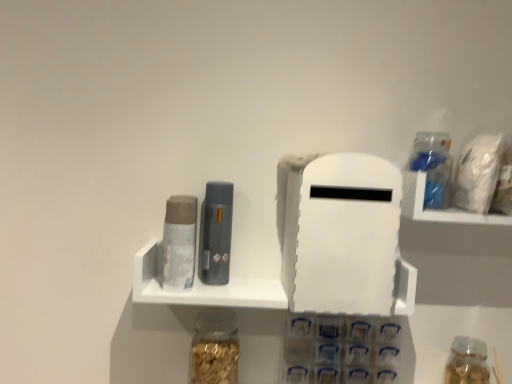
Question: In the image, is white matte plastic shelf at center on the left side or the right side of translucent plastic container at upper right?

Choices:
 (A) right
 (B) left

Answer: (B)

Question: Is white matte plastic shelf at center bigger or smaller than translucent plastic container at upper right?

Choices:
 (A) big
 (B) small

Answer: (A)

Question: Which object is the farthest from the matte gray toiletry at center, which ranks as the 2th toiletry in left-to-right order?

Choices:
 (A) translucent plastic bottle at upper right, the 3th bottle ordered from the bottom
 (B) translucent glass jar at lower center, the third bottle positioned from the right
 (C) translucent glass jar at lower right, which is the first bottle in right-to-left order
 (D) translucent plastic container at upper right
 (E) white matte plastic shelf at center

Answer: (C)

Question: Considering the real-world distances, which object is closest to the translucent plastic container at upper right?

Choices:
 (A) translucent glass jar at lower center, which ranks as the second bottle in bottom-to-top order
 (B) white matte plastic shelf at center
 (C) translucent glass jar at lower right, the 1th bottle ordered from the bottom
 (D) matte gray toiletry at center, which ranks as the 2th toiletry in left-to-right order
 (E) translucent plastic bottle at upper right, the 3th bottle ordered from the bottom

Answer: (E)